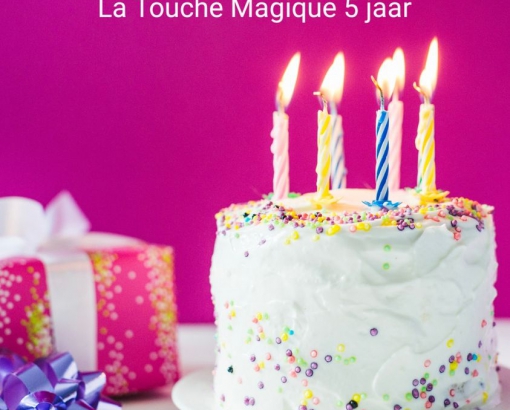
You are a GUI agent. You are given a task and a screenshot of the screen. Output one action in this format:
    pyautogui.click(x=<x>, y=<y>)
    Task: Click on the candle flames
    This screenshot has height=410, width=510.
    Given the screenshot: What is the action you would take?
    pyautogui.click(x=288, y=80), pyautogui.click(x=326, y=77), pyautogui.click(x=336, y=88), pyautogui.click(x=382, y=77), pyautogui.click(x=401, y=69), pyautogui.click(x=424, y=77), pyautogui.click(x=434, y=64)